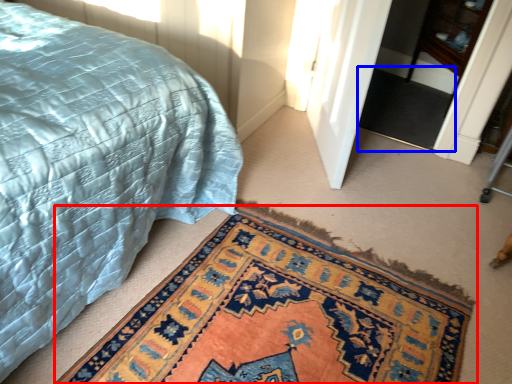
Question: Which of the following is the farthest to the observer, mat (highlighted by a red box) or doormat (highlighted by a blue box)?

Choices:
 (A) mat
 (B) doormat

Answer: (B)